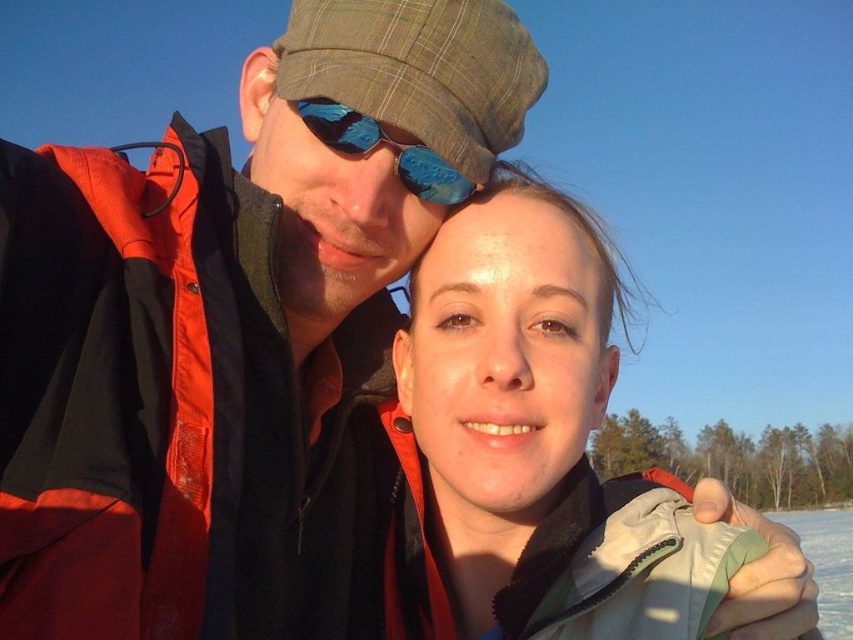
Is matte black jacket at center positioned in front of blue reflective lens at center?

That is True.

Is matte black jacket at center further to camera compared to blue reflective lens at center?

That is False.

Is point (619, 298) farther from camera compared to point (436, 166)?

Yes, point (619, 298) is behind point (436, 166).

Locate an element on the screen. matte black jacket at center is located at coordinates (529, 448).